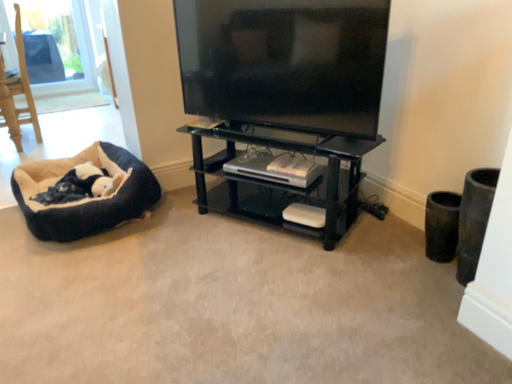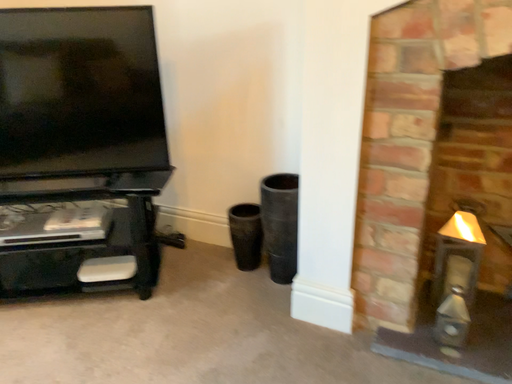
Question: Which way did the camera rotate in the video?

Choices:
 (A) rotated upward
 (B) rotated downward

Answer: (A)